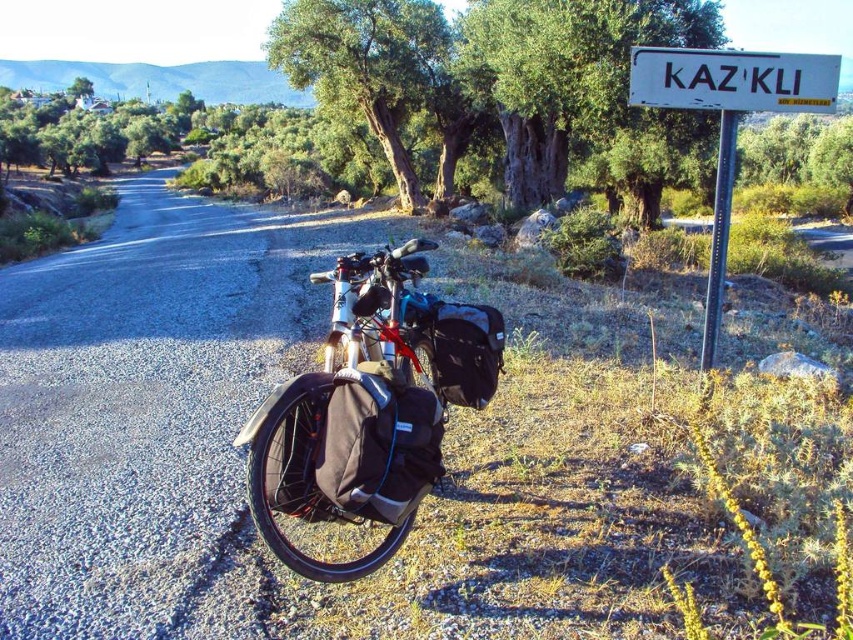
Does point (352, 257) come farther from viewer compared to point (401, 147)?

No, it is not.

Can you confirm if matte black bicycle at center is positioned to the right of green rough bark tree at center?

Indeed, matte black bicycle at center is positioned on the right side of green rough bark tree at center.

At what (x,y) coordinates should I click in order to perform the action: click on matte black bicycle at center. Please return your answer as a coordinate pair (x, y). This screenshot has height=640, width=853. Looking at the image, I should click on (369, 410).

How distant is green leafy tree at upper center from shiny metallic bicycle at center?

The distance of green leafy tree at upper center from shiny metallic bicycle at center is 14.89 meters.

Is green leafy tree at upper center above shiny metallic bicycle at center?

Correct, green leafy tree at upper center is located above shiny metallic bicycle at center.

Between point (584, 40) and point (407, 259), which one is positioned behind?

The point (584, 40) is behind.

I want to click on green leafy tree at upper center, so coord(573,77).

Who is positioned more to the left, white plastic sign at upper center or shiny metallic bicycle at center?

Positioned to the left is shiny metallic bicycle at center.

Which of these two, white plastic sign at upper center or shiny metallic bicycle at center, stands shorter?

shiny metallic bicycle at center is shorter.

What do you see at coordinates (732, 80) in the screenshot? I see `white plastic sign at upper center` at bounding box center [732, 80].

At what (x,y) coordinates should I click in order to perform the action: click on white plastic sign at upper center. Please return your answer as a coordinate pair (x, y). Looking at the image, I should click on (732, 80).